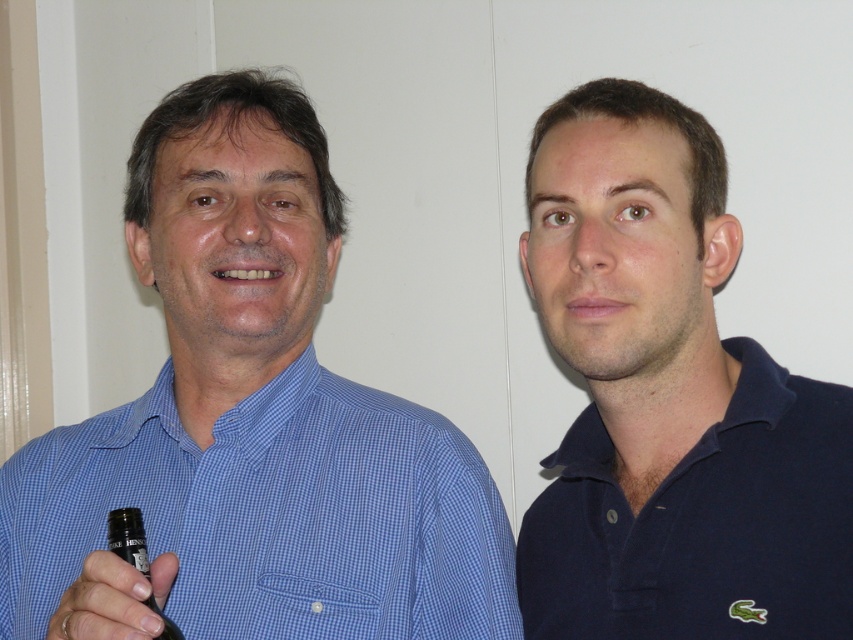
You are taking a photo of two people standing in front of you. The person on the left is wearing a blue checkered shirt, and the one on the right is in a navy blue Lacoste polo shirt. There are two points marked in the image at coordinates point (683, 568) and point (115, 522). Which point is closer to your camera lens?

Point (683, 568) is further to the camera than point (115, 522), so the point closer to the camera lens is point (115, 522).

You are designing a layout for a magazine cover and need to place a photo of the two people. The magazine requires that the matte black bottle at lower left must be positioned at coordinates between 0.9 and 0.1. Does the current placement meet the magazine requirements?

The matte black bottle at lower left is positioned at point (112, 600), which falls within the required coordinates between 0.9 and 0.1. Therefore, the current placement meets the magazine requirements.